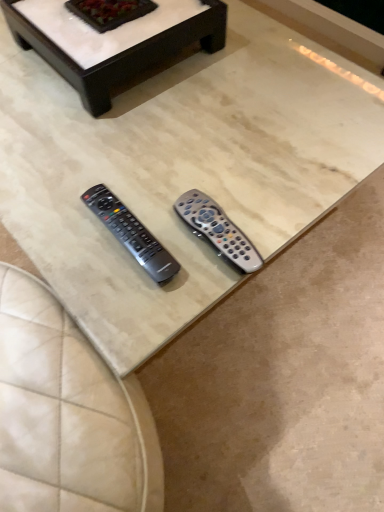
Where is `free spot behind silver metallic remote at center, which is counted as the first remote control, starting from the left`? The image size is (384, 512). free spot behind silver metallic remote at center, which is counted as the first remote control, starting from the left is located at coordinates (135, 164).